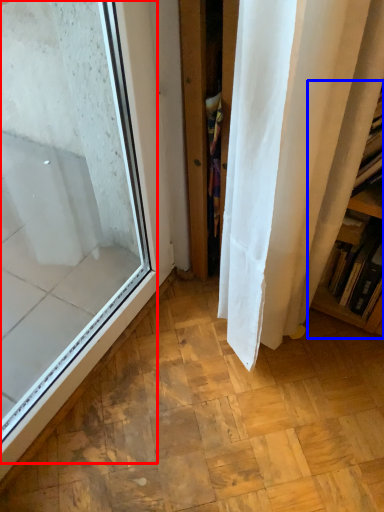
Question: Which point is closer to the camera, window (highlighted by a red box) or bookshelf (highlighted by a blue box)?

Choices:
 (A) window
 (B) bookshelf

Answer: (A)